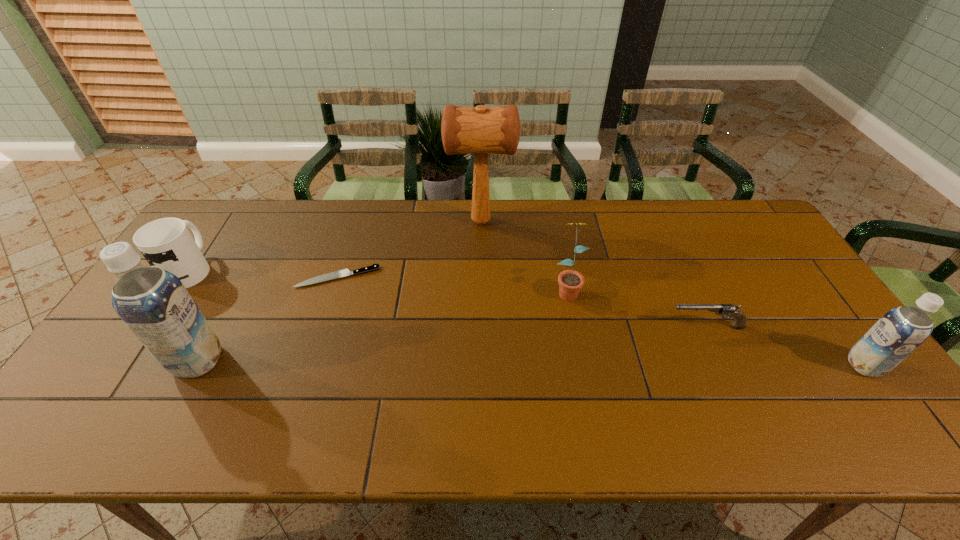
You are a GUI agent. You are given a task and a screenshot of the screen. Output one action in this format:
    pyautogui.click(x=<x>, y=<y>)
    Task: Click on the fifth tallest object
    Image resolution: width=960 pixels, height=540 pixels.
    Given the screenshot: What is the action you would take?
    pyautogui.click(x=166, y=243)

Locate an element on the screen. The width and height of the screenshot is (960, 540). mug is located at coordinates (166, 243).

Image resolution: width=960 pixels, height=540 pixels. I want to click on sunflower, so 570,282.

Where is `free location located 0.080m on the label of the left soya milk`? The width and height of the screenshot is (960, 540). free location located 0.080m on the label of the left soya milk is located at coordinates (252, 361).

Where is `blank space located on the label of the shorter soya milk`? blank space located on the label of the shorter soya milk is located at coordinates (738, 366).

Where is `free space located on the label of the shorter soya milk`? The height and width of the screenshot is (540, 960). free space located on the label of the shorter soya milk is located at coordinates (798, 366).

Image resolution: width=960 pixels, height=540 pixels. Find the location of `free space located 0.200m on the label of the shorter soya milk`. free space located 0.200m on the label of the shorter soya milk is located at coordinates (770, 366).

The height and width of the screenshot is (540, 960). Find the location of `free spot located on the strike surface of the fourth object from right to left`. free spot located on the strike surface of the fourth object from right to left is located at coordinates (433, 222).

The width and height of the screenshot is (960, 540). Find the location of `vacant space located 0.050m on the strike surface of the fourth object from right to left`. vacant space located 0.050m on the strike surface of the fourth object from right to left is located at coordinates point(433,222).

Locate an element on the screen. The height and width of the screenshot is (540, 960). vacant position located on the strike surface of the fourth object from right to left is located at coordinates (433, 222).